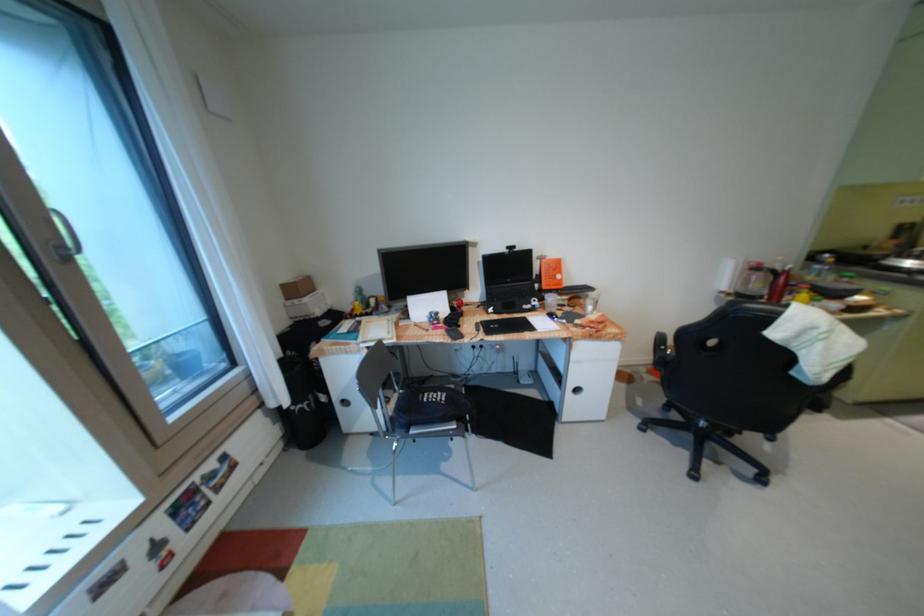
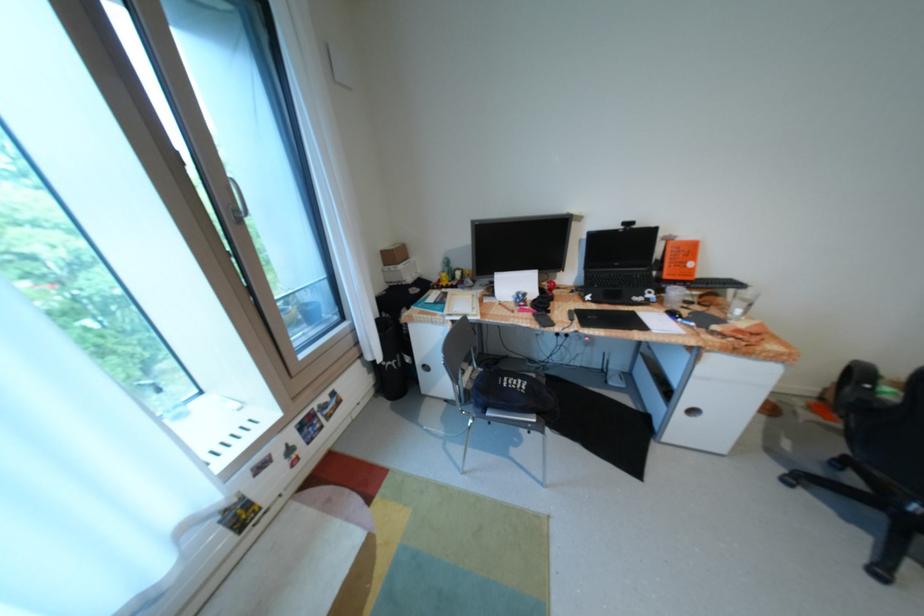
Where in the second image is the point corresponding to point (300, 302) from the first image?

(397, 268)